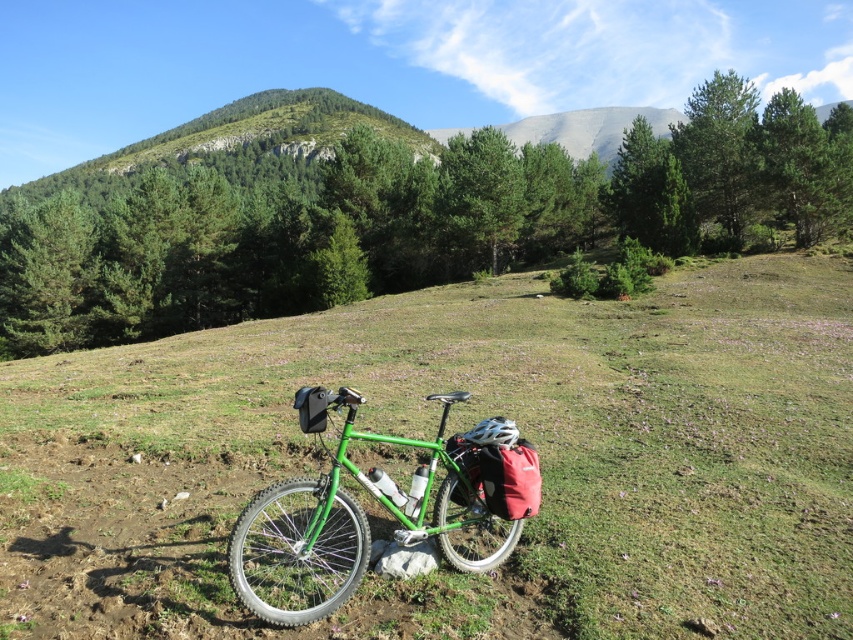
Between green matte grass at center and green matte bicycle at center, which one has less height?

green matte bicycle at center

Does green matte grass at center appear under green matte bicycle at center?

Incorrect, green matte grass at center is not positioned below green matte bicycle at center.

Is point (28, 417) more distant than point (524, 516)?

Yes, it is behind point (524, 516).

Locate an element on the screen. The width and height of the screenshot is (853, 640). green matte grass at center is located at coordinates (461, 429).